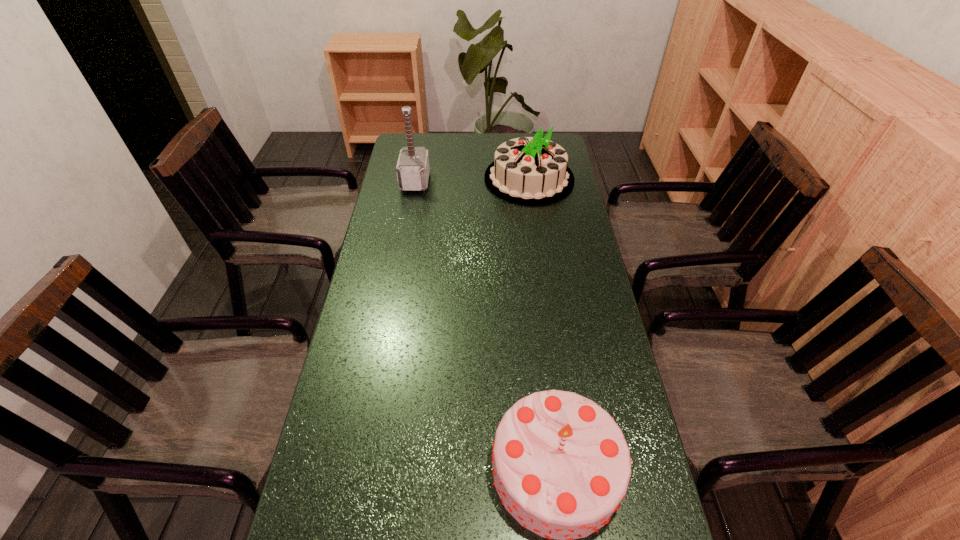
Where is `the leftmost object`? The width and height of the screenshot is (960, 540). the leftmost object is located at coordinates (413, 168).

Where is `the tallest object`? The height and width of the screenshot is (540, 960). the tallest object is located at coordinates (413, 168).

Where is `the farther birthday cake`? This screenshot has width=960, height=540. the farther birthday cake is located at coordinates (532, 171).

The image size is (960, 540). In order to click on vacant space situated for striking with the head of the leftmost object in this screenshot , I will do `click(492, 181)`.

Identify the location of blank space located 0.280m on the left of the farther birthday cake. (414, 179).

Where is `object present at the far edge`? This screenshot has height=540, width=960. object present at the far edge is located at coordinates (532, 171).

Identify the location of object that is at the left edge. This screenshot has width=960, height=540. (413, 168).

Locate an element on the screen. object located at the right edge is located at coordinates (532, 171).

Identify the location of object located in the far right corner section of the desktop. This screenshot has width=960, height=540. (532, 171).

In the image, there is a desktop. Where is `vacant area at the far edge`? The width and height of the screenshot is (960, 540). vacant area at the far edge is located at coordinates (479, 158).